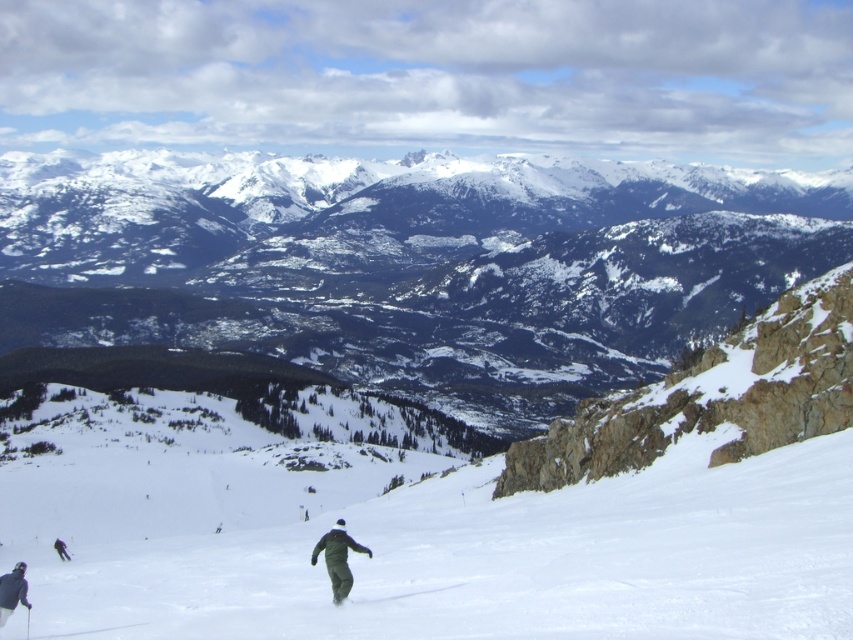
From the picture: You are a photographer positioned at the origin point of the image. You want to capture a photo of the dark green fabric pants at center. What is the coordinate of the object you need to focus on?

The dark green fabric pants at center is located at point [337,557], so you should focus your camera on those coordinates to capture the object.

You are a photographer trying to capture the skier in the scene. You notice the dark green fabric pants at center and the green matte ski at center. Which object is wider when viewed from your position?

The dark green fabric pants at center is wider than the green matte ski at center.

You are a photographer standing at the base of the mountain. You want to capture a photo that includes both the dark gray snowsuit at lower left and the green matte ski at center. Given that your camera has a maximum focus range of 50 feet, will you be able to focus on both subjects simultaneously?

The dark gray snowsuit at lower left is 55.43 feet from the green matte ski at center. Since the distance between them exceeds the camera lens focus range of 50 feet, you won your camera may not be able to focus on both subjects simultaneously.